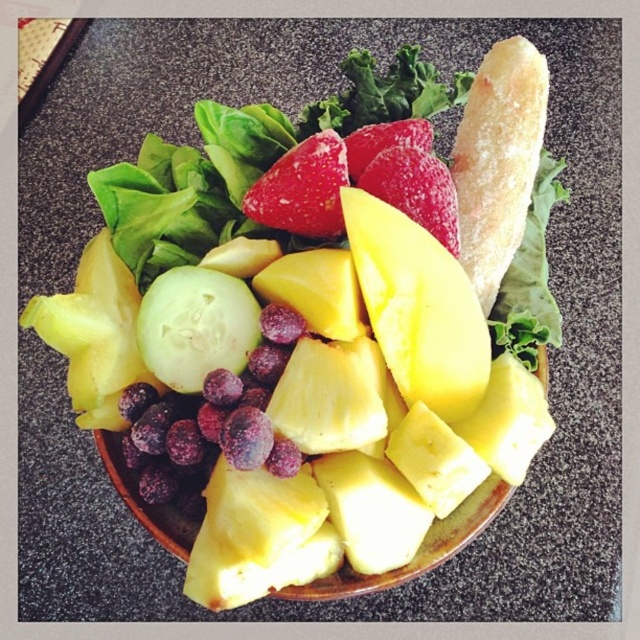
Question: Does golden crusty bread at upper right come in front of shiny red strawberry at center?

Choices:
 (A) yes
 (B) no

Answer: (B)

Question: Which point is farther from the camera taking this photo?

Choices:
 (A) (518, 42)
 (B) (381, 332)
 (C) (284, 205)

Answer: (A)

Question: Which object appears farthest from the camera in this image?

Choices:
 (A) golden crusty bread at upper right
 (B) yellow juicy pineapple at center
 (C) shiny red strawberry at center

Answer: (A)

Question: Does yellow juicy pineapple at center appear on the left side of golden crusty bread at upper right?

Choices:
 (A) no
 (B) yes

Answer: (B)

Question: Which of the following is the closest to the observer?

Choices:
 (A) (458, 164)
 (B) (291, 230)
 (C) (445, 337)

Answer: (C)

Question: Is yellow juicy pineapple at center to the right of shiny red strawberry at center from the viewer's perspective?

Choices:
 (A) yes
 (B) no

Answer: (A)